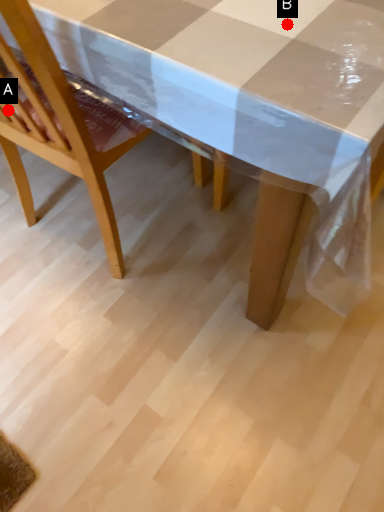
Question: Two points are circled on the image, labeled by A and B beside each circle. Which point is farther to the camera?

Choices:
 (A) A is further
 (B) B is further

Answer: (A)